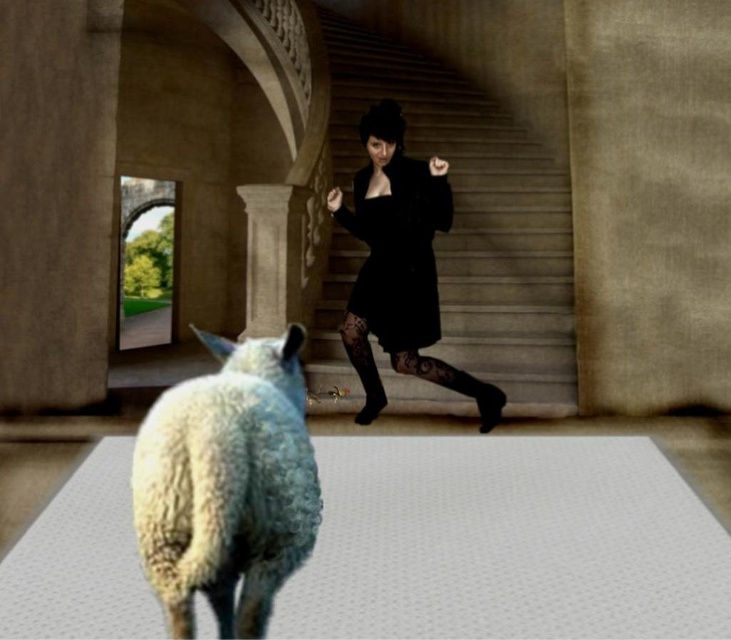
You are an interior designer planning to place a decorative item on the white textured mat at center. Considering the size of the white woolen sheep at lower left, will the mat be able to accommodate a large centerpiece that is twice the size of the sheep?

The white textured mat at center has a larger size compared to the white woolen sheep at lower left. Since the mat is bigger than the sheep, a centerpiece twice the sheep size might still fit, but it depends on the mat dimensions. However, based on the given info, the mat can likely accommodate it.

You are standing in the grand classical interior space and want to place a decorative vase on the white textured mat at center. According to the scene description, where exactly should you place the vase?

The white textured mat at center is located at coordinates point (507, 541), so you should place the vase at that exact position.

You are standing in the grand classical interior space and want to walk from the smooth stone stairs at center to the black matte dress at center. Which direction should you move towards?

The smooth stone stairs at center is positioned on the right side of black matte dress at center, so you should move towards the left to reach the black matte dress at center.